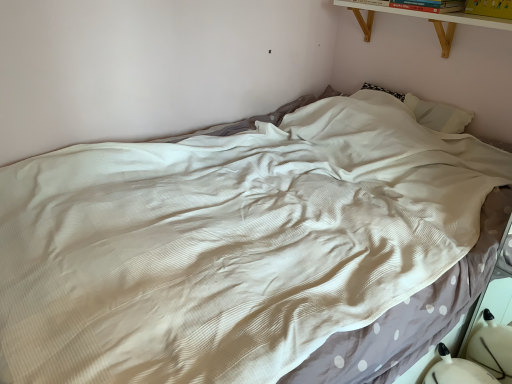
Where is `free space to the left of yellow paper at upper right, the 1th book from the right`? This screenshot has height=384, width=512. free space to the left of yellow paper at upper right, the 1th book from the right is located at coordinates (469, 17).